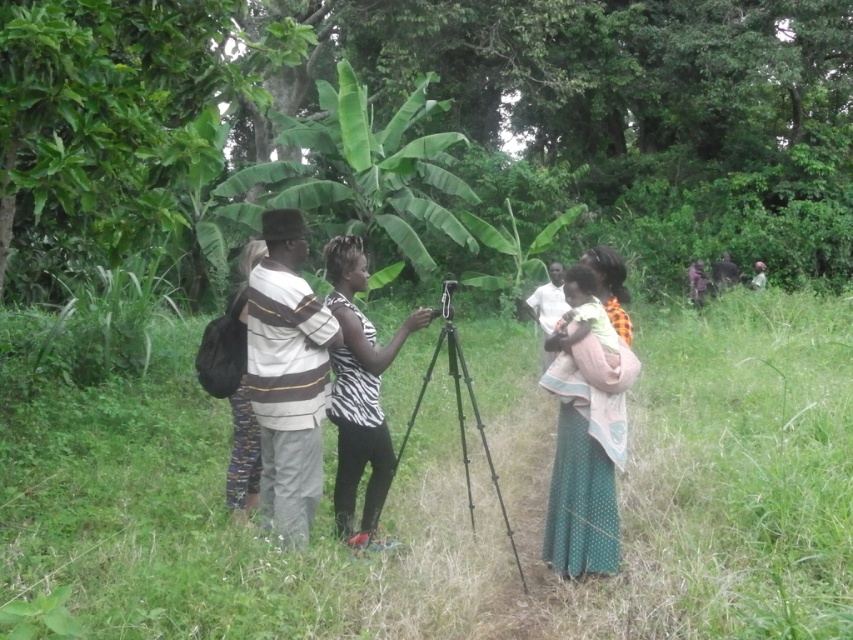
Question: Which point appears closest to the camera in this image?

Choices:
 (A) click(x=512, y=545)
 (B) click(x=238, y=413)
 (C) click(x=764, y=266)

Answer: (A)

Question: Does green leafy tree at center appear on the left side of dark brown leather jacket at right?

Choices:
 (A) yes
 (B) no

Answer: (A)

Question: Which point appears closest to the camera in this image?

Choices:
 (A) (103, 116)
 (B) (277, 268)
 (C) (703, 273)
 (D) (755, 282)

Answer: (A)

Question: Among these points, which one is nearest to the camera?

Choices:
 (A) (242, 380)
 (B) (314, 452)

Answer: (B)

Question: Does dark brown leather jacket at right have a lesser width compared to white fabric at center?

Choices:
 (A) yes
 (B) no

Answer: (B)

Question: Can you confirm if green leafy banana tree at center is positioned below dark brown leather jacket at right?

Choices:
 (A) yes
 (B) no

Answer: (B)